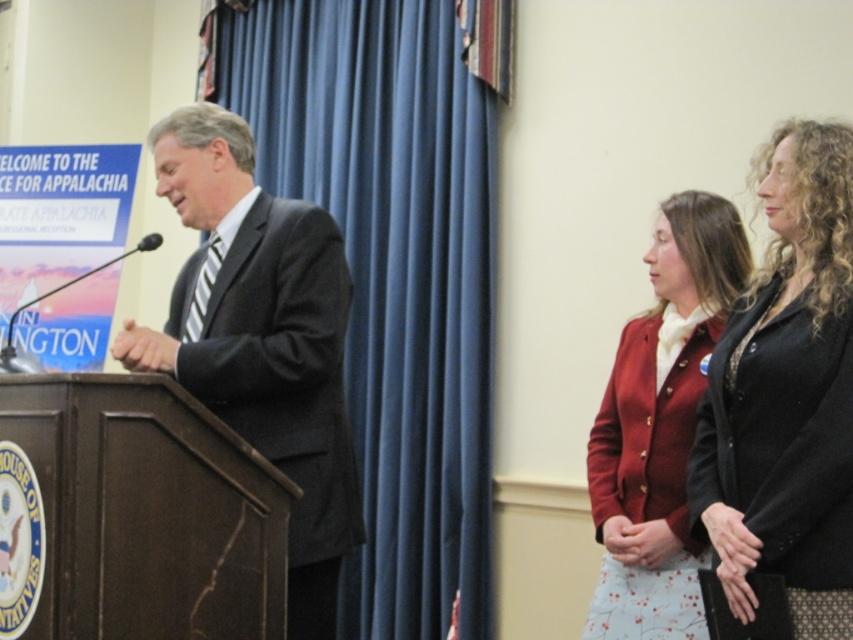
Is blue fabric curtain at center further to the viewer compared to dark gray suit at center?

Yes, blue fabric curtain at center is behind dark gray suit at center.

Who is higher up, blue fabric curtain at center or dark gray suit at center?

blue fabric curtain at center is above.

Find the location of a particular element. blue fabric curtain at center is located at coordinates (392, 275).

You are a GUI agent. You are given a task and a screenshot of the screen. Output one action in this format:
    pyautogui.click(x=<x>, y=<y>)
    Task: Click on the blue fabric curtain at center
    This screenshot has height=640, width=853.
    Given the screenshot: What is the action you would take?
    pyautogui.click(x=392, y=275)

Looking at this image, who is shorter, black matte blazer at right or dark gray suit at center?

With less height is black matte blazer at right.

Does black matte blazer at right have a lesser height compared to dark gray suit at center?

Indeed, black matte blazer at right has a lesser height compared to dark gray suit at center.

Where is `black matte blazer at right`? Image resolution: width=853 pixels, height=640 pixels. black matte blazer at right is located at coordinates (786, 394).

At what (x,y) coordinates should I click in order to perform the action: click on black matte blazer at right. Please return your answer as a coordinate pair (x, y). This screenshot has height=640, width=853. Looking at the image, I should click on (786, 394).

Which is behind, point (198, 289) or point (602, 545)?

The point (602, 545) is more distant.

Who is lower down, dark gray suit at center or matte red blazer at center?

Positioned lower is matte red blazer at center.

Measure the distance between dark gray suit at center and camera.

dark gray suit at center is 2.25 meters from camera.

Image resolution: width=853 pixels, height=640 pixels. In order to click on dark gray suit at center in this screenshot , I will do `click(260, 339)`.